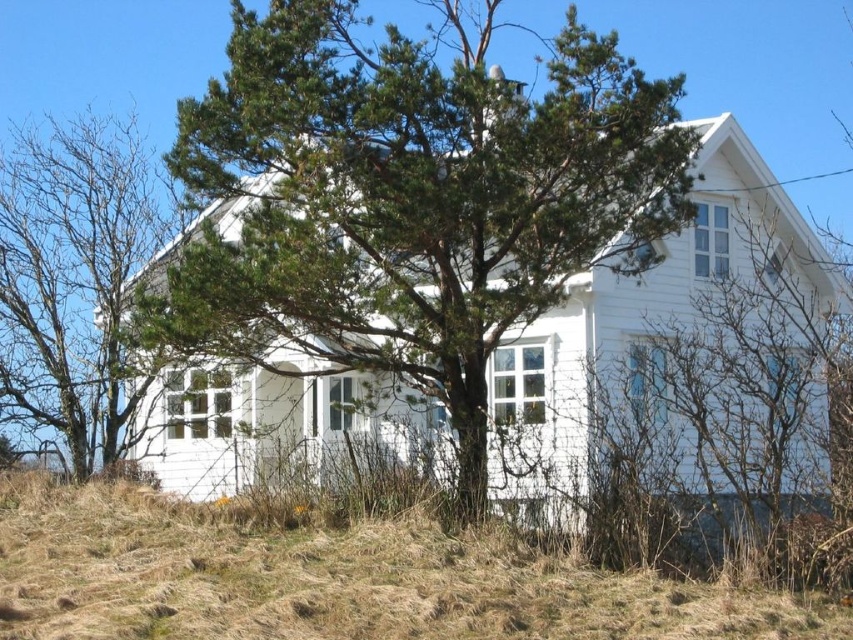
Question: Which of the following is the closest to the observer?

Choices:
 (A) (38, 406)
 (B) (595, 614)
 (C) (183, 136)

Answer: (B)

Question: Is green needle-like tree at center to the left of dry grass at lower left from the viewer's perspective?

Choices:
 (A) yes
 (B) no

Answer: (B)

Question: Does green needle-like tree at center have a smaller size compared to green leafy tree at left?

Choices:
 (A) no
 (B) yes

Answer: (B)

Question: Among these points, which one is farthest from the camera?

Choices:
 (A) (86, 484)
 (B) (102, 198)

Answer: (B)

Question: Can you confirm if dry grass at lower left is positioned above green leafy tree at left?

Choices:
 (A) no
 (B) yes

Answer: (A)

Question: Considering the real-world distances, which object is closest to the green needle-like tree at center?

Choices:
 (A) dry grass at lower left
 (B) green leafy tree at left

Answer: (A)